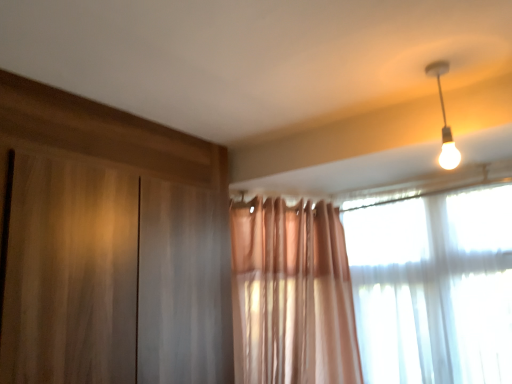
This screenshot has width=512, height=384. I want to click on translucent fabric window at upper right, so click(x=434, y=287).

What do you see at coordinates (434, 287) in the screenshot? The image size is (512, 384). I see `translucent fabric window at upper right` at bounding box center [434, 287].

The image size is (512, 384). Describe the element at coordinates (444, 120) in the screenshot. I see `white glossy bulb at upper right` at that location.

In order to face white glossy bulb at upper right, should I rotate leftwards or rightwards?

A 23.439 degree turn to the right will do.

I want to click on white glossy bulb at upper right, so click(444, 120).

Find the location of a particular element. The width and height of the screenshot is (512, 384). translucent fabric window at upper right is located at coordinates (434, 287).

Which object is positioned more to the left, translucent fabric window at upper right or white glossy bulb at upper right?

white glossy bulb at upper right.

Which is in front, translucent fabric window at upper right or white glossy bulb at upper right?

white glossy bulb at upper right is in front.

Is point (451, 255) positioned after point (448, 164)?

Yes, point (451, 255) is farther from viewer.

Consider the image. From the image's perspective, who appears lower, translucent fabric window at upper right or white glossy bulb at upper right?

translucent fabric window at upper right, from the image's perspective.

From a real-world perspective, which is physically above, translucent fabric window at upper right or white glossy bulb at upper right?

white glossy bulb at upper right is physically above.

Considering the relative sizes of translucent fabric window at upper right and white glossy bulb at upper right in the image provided, is translucent fabric window at upper right wider than white glossy bulb at upper right?

Yes, translucent fabric window at upper right is wider than white glossy bulb at upper right.

Can you confirm if translucent fabric window at upper right is shorter than white glossy bulb at upper right?

No.

Looking at the image, does translucent fabric window at upper right seem bigger or smaller compared to white glossy bulb at upper right?

translucent fabric window at upper right is bigger than white glossy bulb at upper right.

Is white glossy bulb at upper right surrounded by translucent fabric window at upper right?

No, white glossy bulb at upper right is located outside of translucent fabric window at upper right.

Is translucent fabric window at upper right with white glossy bulb at upper right?

No.

Could you tell me if translucent fabric window at upper right is turned towards white glossy bulb at upper right?

Yes, translucent fabric window at upper right is oriented towards white glossy bulb at upper right.

How many degrees apart are the facing directions of translucent fabric window at upper right and white glossy bulb at upper right?

translucent fabric window at upper right and white glossy bulb at upper right are facing 6.86 degrees away from each other.

In the image, there is a translucent fabric window at upper right. At what (x,y) coordinates should I click in order to perform the action: click on lamp above it (from the image's perspective). Please return your answer as a coordinate pair (x, y). The width and height of the screenshot is (512, 384). Looking at the image, I should click on (444, 120).

Based on the photo, visually, is white glossy bulb at upper right positioned to the left or to the right of translucent fabric window at upper right?

white glossy bulb at upper right is to the left of translucent fabric window at upper right.

Which object is closer to the camera taking this photo, white glossy bulb at upper right or translucent fabric window at upper right?

white glossy bulb at upper right is more forward.

Between point (445, 149) and point (409, 357), which one is positioned behind?

Point (409, 357)

From the image's perspective, is white glossy bulb at upper right on translucent fabric window at upper right?

Yes, from the image's perspective, white glossy bulb at upper right is on top of translucent fabric window at upper right.

From a real-world perspective, is white glossy bulb at upper right positioned under translucent fabric window at upper right based on gravity?

No, from a real-world perspective, white glossy bulb at upper right is not below translucent fabric window at upper right.

Does white glossy bulb at upper right have a lesser width compared to translucent fabric window at upper right?

Correct, the width of white glossy bulb at upper right is less than that of translucent fabric window at upper right.

In terms of height, does white glossy bulb at upper right look taller or shorter compared to translucent fabric window at upper right?

Considering their sizes, white glossy bulb at upper right has less height than translucent fabric window at upper right.

Considering the sizes of objects white glossy bulb at upper right and translucent fabric window at upper right in the image provided, who is smaller, white glossy bulb at upper right or translucent fabric window at upper right?

Smaller between the two is white glossy bulb at upper right.

Is white glossy bulb at upper right located outside translucent fabric window at upper right?

Yes.

In the scene shown: Is white glossy bulb at upper right touching translucent fabric window at upper right?

No, white glossy bulb at upper right is not with translucent fabric window at upper right.

Could you tell me if white glossy bulb at upper right is facing translucent fabric window at upper right?

No, white glossy bulb at upper right is not aimed at translucent fabric window at upper right.

Can you tell me how much white glossy bulb at upper right and translucent fabric window at upper right differ in facing direction?

6.86 degrees separate the facing orientations of white glossy bulb at upper right and translucent fabric window at upper right.

How much distance is there between white glossy bulb at upper right and translucent fabric window at upper right?

white glossy bulb at upper right is 65.01 centimeters away from translucent fabric window at upper right.

This screenshot has height=384, width=512. In order to click on window that is under the white glossy bulb at upper right (from a real-world perspective) in this screenshot , I will do `click(434, 287)`.

Where is `window behind the white glossy bulb at upper right`? This screenshot has height=384, width=512. window behind the white glossy bulb at upper right is located at coordinates (434, 287).

In the image, there is a white glossy bulb at upper right. Identify the location of window below it (from the image's perspective). This screenshot has height=384, width=512. (434, 287).